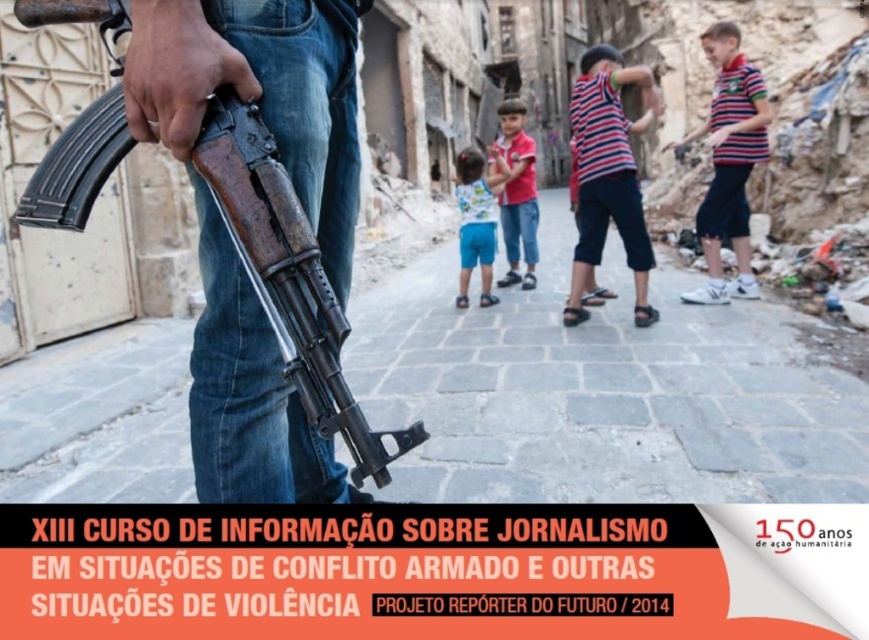
Which is behind, point (591, 188) or point (528, 212)?

The point (528, 212) is behind.

Who is taller, striped fabric shirt at center or matte red shirt at center?

matte red shirt at center

Locate an element on the screen. striped fabric shirt at center is located at coordinates (607, 176).

Can you confirm if striped fabric shirt at center is positioned to the right of striped cotton shirt at right?

No, striped fabric shirt at center is not to the right of striped cotton shirt at right.

Does striped fabric shirt at center appear over striped cotton shirt at right?

Yes, striped fabric shirt at center is above striped cotton shirt at right.

The width and height of the screenshot is (869, 640). What are the coordinates of `striped fabric shirt at center` in the screenshot? It's located at (607, 176).

Does point (718, 28) come closer to viewer compared to point (463, 266)?

Yes.

The width and height of the screenshot is (869, 640). Describe the element at coordinates (728, 163) in the screenshot. I see `striped cotton shirt at right` at that location.

You are a GUI agent. You are given a task and a screenshot of the screen. Output one action in this format:
    pyautogui.click(x=<x>, y=<y>)
    Task: Click on the striped cotton shirt at right
    The height and width of the screenshot is (640, 869).
    Given the screenshot: What is the action you would take?
    pyautogui.click(x=728, y=163)